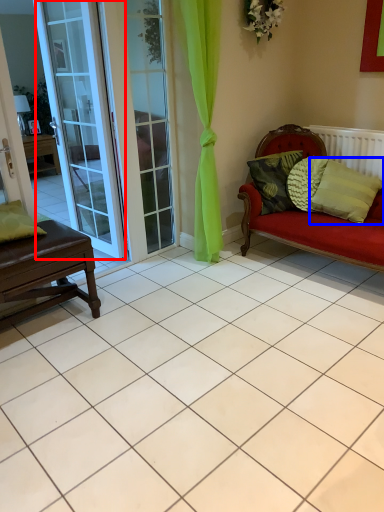
Question: Which of the following is the farthest to the observer, door (highlighted by a red box) or pillow (highlighted by a blue box)?

Choices:
 (A) door
 (B) pillow

Answer: (B)